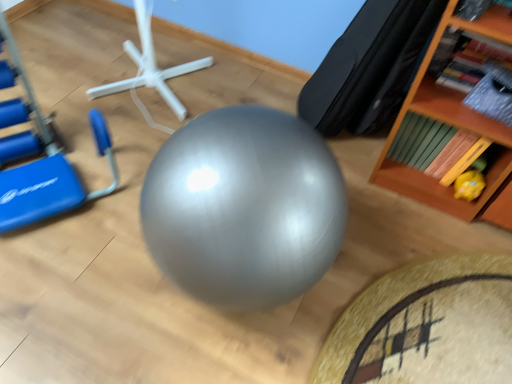
The width and height of the screenshot is (512, 384). I want to click on black leather bean bag chair at upper right, so click(370, 67).

Measure the distance between wooden bookshelf at upper right and camera.

The distance of wooden bookshelf at upper right from camera is 1.17 meters.

The width and height of the screenshot is (512, 384). I want to click on white plastic stand at center, so click(149, 67).

Where is `blue plastic swivel chair at left`? This screenshot has height=384, width=512. blue plastic swivel chair at left is located at coordinates (42, 159).

How far apart are white plastic stand at center and blue plastic swivel chair at left?

They are 47.28 centimeters apart.

Would you say white plastic stand at center is inside or outside blue plastic swivel chair at left?

white plastic stand at center cannot be found inside blue plastic swivel chair at left.

Find the location of a particular element. sport equipment located underneath the blue plastic swivel chair at left (from a real-world perspective) is located at coordinates (149, 67).

In the scene shown: Is white plastic stand at center taller than blue plastic swivel chair at left?

Incorrect, the height of white plastic stand at center is not larger of that of blue plastic swivel chair at left.

From a real-world perspective, is wooden bookshelf at upper right on top of yellow rubber duck at lower right?

Indeed, from a real-world perspective, wooden bookshelf at upper right stands above yellow rubber duck at lower right.

From the image's perspective, which is above, wooden bookshelf at upper right or yellow rubber duck at lower right?

wooden bookshelf at upper right appears higher in the image.

Which is correct: wooden bookshelf at upper right is inside yellow rubber duck at lower right, or outside of it?

wooden bookshelf at upper right is spatially situated outside yellow rubber duck at lower right.

Is wooden bookshelf at upper right at the right side of black leather bean bag chair at upper right?

Indeed, wooden bookshelf at upper right is positioned on the right side of black leather bean bag chair at upper right.

Can we say wooden bookshelf at upper right lies outside black leather bean bag chair at upper right?

Yes, wooden bookshelf at upper right is outside of black leather bean bag chair at upper right.

Is wooden bookshelf at upper right facing away from black leather bean bag chair at upper right?

That's not correct — wooden bookshelf at upper right is not looking away from black leather bean bag chair at upper right.

Which is more to the right, yellow rubber duck at lower right or blue plastic swivel chair at left?

A: Positioned to the right is yellow rubber duck at lower right.

Would you say yellow rubber duck at lower right contains blue plastic swivel chair at left?

No, blue plastic swivel chair at left is not inside yellow rubber duck at lower right.

Which point is more distant from viewer, (481, 188) or (32, 105)?

The point (32, 105) is farther.

How many degrees apart are the facing directions of yellow rubber duck at lower right and blue plastic swivel chair at left?

The angular difference between yellow rubber duck at lower right and blue plastic swivel chair at left is 52.8 degrees.

Is black leather bean bag chair at upper right far away from yellow rubber duck at lower right?

No.

From the image's perspective, who appears lower, black leather bean bag chair at upper right or yellow rubber duck at lower right?

From the image's view, yellow rubber duck at lower right is below.

Based on their sizes in the image, would you say black leather bean bag chair at upper right is bigger or smaller than yellow rubber duck at lower right?

Clearly, black leather bean bag chair at upper right is larger in size than yellow rubber duck at lower right.

This screenshot has height=384, width=512. I want to click on swivel chair below the black leather bean bag chair at upper right (from the image's perspective), so click(42, 159).

In the scene shown: Can you tell me how much black leather bean bag chair at upper right and blue plastic swivel chair at left differ in facing direction?

94.6 degrees.

Would you consider black leather bean bag chair at upper right to be distant from blue plastic swivel chair at left?

Yes, black leather bean bag chair at upper right and blue plastic swivel chair at left are quite far apart.

From the image's perspective, is black leather bean bag chair at upper right located above or below blue plastic swivel chair at left?

black leather bean bag chair at upper right is above blue plastic swivel chair at left.

Which object is positioned more to the left, wooden bookshelf at upper right or blue plastic swivel chair at left?

From the viewer's perspective, blue plastic swivel chair at left appears more on the left side.

In the image, is wooden bookshelf at upper right positioned in front of or behind blue plastic swivel chair at left?

Visually, wooden bookshelf at upper right is located behind blue plastic swivel chair at left.

Is wooden bookshelf at upper right facing towards blue plastic swivel chair at left?

No, wooden bookshelf at upper right is not oriented towards blue plastic swivel chair at left.

Locate an element on the screen. The height and width of the screenshot is (384, 512). sport equipment below the blue plastic swivel chair at left (from a real-world perspective) is located at coordinates (x=149, y=67).

You are a GUI agent. You are given a task and a screenshot of the screen. Output one action in this format:
    pyautogui.click(x=<x>, y=<y>)
    Task: Click on the shelf above the yellow rubber duck at lower right (from a real-world perspective)
    
    Given the screenshot: What is the action you would take?
    pyautogui.click(x=450, y=123)

When comparing their distances from white plastic stand at center, does black leather bean bag chair at upper right or blue plastic swivel chair at left seem further?

black leather bean bag chair at upper right lies further to white plastic stand at center than the other object.

Which object lies nearer to the anchor point wooden bookshelf at upper right, yellow rubber duck at lower right or white plastic stand at center?

yellow rubber duck at lower right is closer to wooden bookshelf at upper right.

Estimate the real-world distances between objects in this image. Which object is further from blue plastic swivel chair at left, yellow rubber duck at lower right or black leather bean bag chair at upper right?

yellow rubber duck at lower right lies further to blue plastic swivel chair at left than the other object.

Based on their spatial positions, is black leather bean bag chair at upper right or wooden bookshelf at upper right further from white plastic stand at center?

Based on the image, wooden bookshelf at upper right appears to be further to white plastic stand at center.

From the image, which object appears to be nearer to black leather bean bag chair at upper right, white plastic stand at center or yellow rubber duck at lower right?

yellow rubber duck at lower right is positioned closer to the anchor black leather bean bag chair at upper right.

Based on their spatial positions, is yellow rubber duck at lower right or wooden bookshelf at upper right closer to blue plastic swivel chair at left?

wooden bookshelf at upper right.

Looking at the image, which one is located further to wooden bookshelf at upper right, blue plastic swivel chair at left or yellow rubber duck at lower right?

Based on the image, blue plastic swivel chair at left appears to be further to wooden bookshelf at upper right.

Which object lies further to the anchor point yellow rubber duck at lower right, blue plastic swivel chair at left or wooden bookshelf at upper right?

blue plastic swivel chair at left lies further to yellow rubber duck at lower right than the other object.

This screenshot has width=512, height=384. I want to click on bean bag chair located between white plastic stand at center and wooden bookshelf at upper right in the left-right direction, so click(x=370, y=67).

This screenshot has width=512, height=384. I want to click on sport equipment between blue plastic swivel chair at left and black leather bean bag chair at upper right, so click(149, 67).

Find the location of a particular element. Image resolution: width=512 pixels, height=384 pixels. bean bag chair between blue plastic swivel chair at left and yellow rubber duck at lower right is located at coordinates (370, 67).

At what (x,y) coordinates should I click in order to perform the action: click on shelf between black leather bean bag chair at upper right and yellow rubber duck at lower right vertically. Please return your answer as a coordinate pair (x, y). This screenshot has height=384, width=512. Looking at the image, I should click on (450, 123).